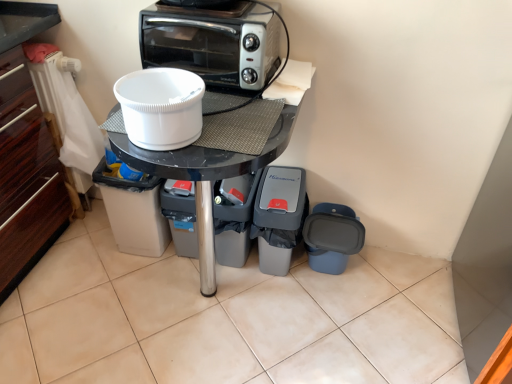
Question: From a real-world perspective, is black glossy table at center physically located above or below blue plastic trash can at lower right, the 1th appliance positioned from the right?

Choices:
 (A) below
 (B) above

Answer: (B)

Question: Considering the positions of black glossy table at center and blue plastic trash can at lower right, the fifth appliance when ordered from left to right, in the image, is black glossy table at center wider or thinner than blue plastic trash can at lower right, the fifth appliance when ordered from left to right,?

Choices:
 (A) wide
 (B) thin

Answer: (A)

Question: Which object is the closest to the black glossy table at center?

Choices:
 (A) silver metallic toaster oven at upper center
 (B) white plastic bowl at center, which is the fourth appliance in right-to-left order
 (C) blue plastic trash can at lower right, the 1th appliance positioned from the right
 (D) gray plastic trash can at lower center, arranged as the second appliance when viewed from the right
 (E) white plastic bucket at center, the first appliance in the left-to-right sequence

Answer: (B)

Question: Estimate the real-world distances between objects in this image. Which object is closer to the gray plastic trash can at lower center, the 4th appliance viewed from the left?

Choices:
 (A) black glossy table at center
 (B) gray plastic trash can at lower center, which is counted as the 3th appliance, starting from the right
 (C) white plastic bowl at center, the 2th appliance viewed from the left
 (D) silver metallic toaster oven at upper center
 (E) white plastic bucket at center, placed as the fifth appliance when sorted from right to left

Answer: (B)